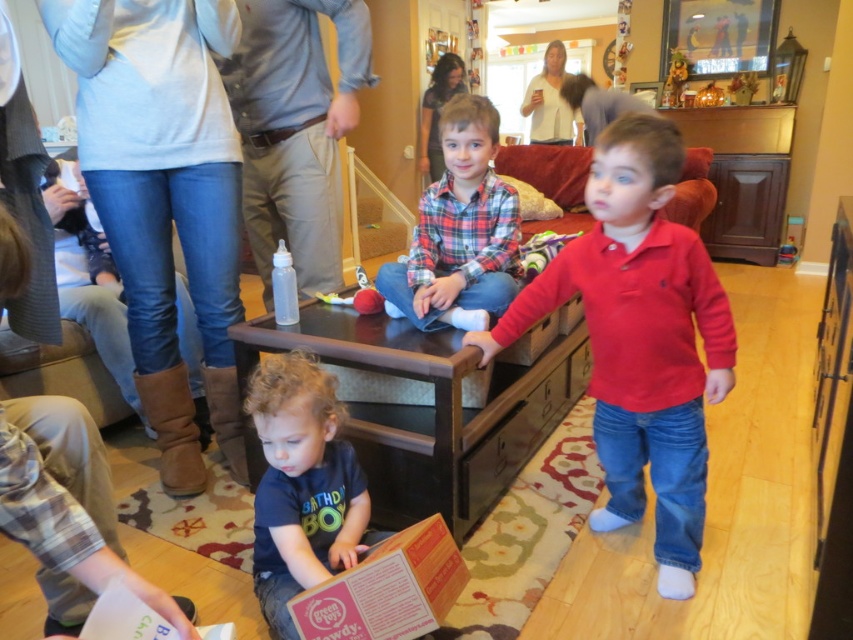
Is point (265, 445) less distant than point (569, 378)?

Yes, it is in front of point (569, 378).

Who is higher up, dark blue cotton shirt at lower left or wooden drawer at center?

→ Positioned higher is wooden drawer at center.

Is point (349, 508) positioned before point (569, 358)?

Yes, it is in front of point (569, 358).

Where is `dark blue cotton shirt at lower left`? dark blue cotton shirt at lower left is located at coordinates (300, 484).

Between red cotton shirt at center and orange cardboard box at lower center, which one appears on the left side from the viewer's perspective?

orange cardboard box at lower center

Does red cotton shirt at center have a smaller size compared to orange cardboard box at lower center?

Incorrect, red cotton shirt at center is not smaller in size than orange cardboard box at lower center.

Where is `red cotton shirt at center`? Image resolution: width=853 pixels, height=640 pixels. red cotton shirt at center is located at coordinates (640, 339).

Is point (289, 472) more distant than point (310, 598)?

Yes, it is behind point (310, 598).

Is dark blue cotton shirt at lower left below orange cardboard box at lower center?

Actually, dark blue cotton shirt at lower left is above orange cardboard box at lower center.

Image resolution: width=853 pixels, height=640 pixels. I want to click on dark blue cotton shirt at lower left, so click(x=300, y=484).